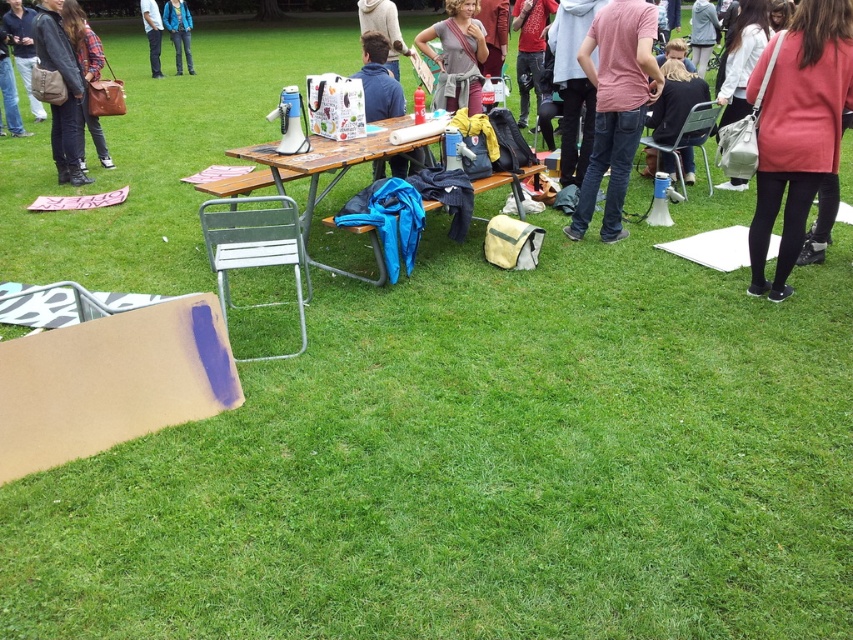
Who is shorter, matte red coat at right or blue denim jeans at center?

matte red coat at right

Can you confirm if matte red coat at right is smaller than blue denim jeans at center?

Correct, matte red coat at right occupies less space than blue denim jeans at center.

Measure the distance between point (787, 64) and camera.

3.92 meters

I want to click on matte red coat at right, so click(799, 131).

Does leather brown bag at upper left lie behind light brown leather jacket at upper center?

Yes, leather brown bag at upper left is behind light brown leather jacket at upper center.

Is point (30, 17) positioned after point (392, 28)?

That is True.

The width and height of the screenshot is (853, 640). What are the coordinates of `leather brown bag at upper left` in the screenshot? It's located at (22, 49).

Who is positioned more to the left, pink cotton t-shirt at center or wooden picnic table at center?

Positioned to the left is wooden picnic table at center.

Who is more forward, (604, 93) or (403, 147)?

Point (403, 147) is more forward.

What do you see at coordinates (614, 106) in the screenshot?
I see `pink cotton t-shirt at center` at bounding box center [614, 106].

Locate an element on the screen. pink cotton t-shirt at center is located at coordinates (614, 106).